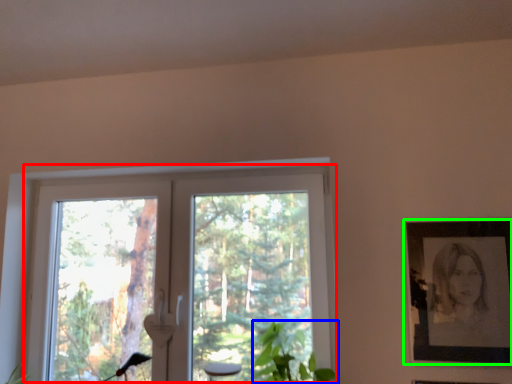
Question: Which is farther away from window (highlighted by a red box)? plant (highlighted by a blue box) or picture frame (highlighted by a green box)?

Choices:
 (A) plant
 (B) picture frame

Answer: (B)